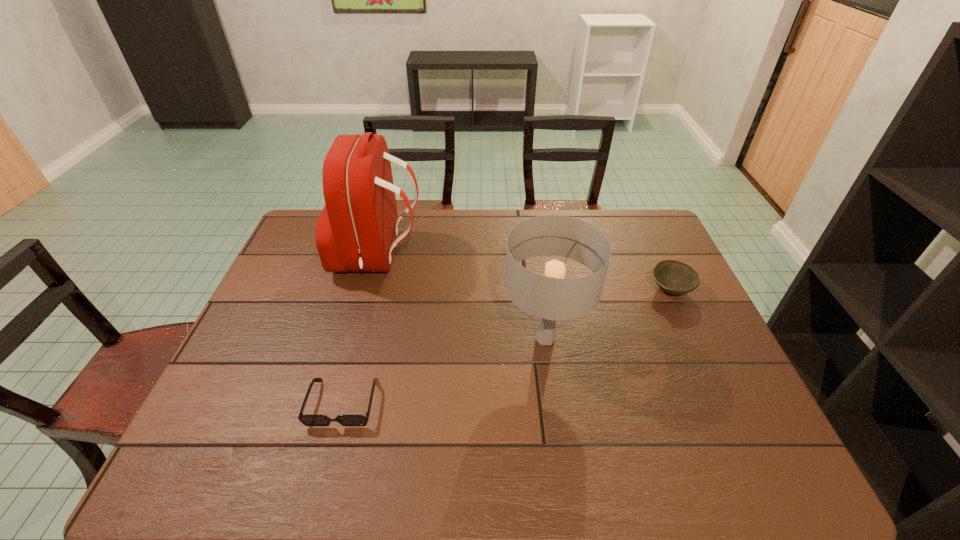
Where is `backpack`? The image size is (960, 540). backpack is located at coordinates (357, 231).

You are a GUI agent. You are given a task and a screenshot of the screen. Output one action in this format:
    pyautogui.click(x=<x>, y=<y>)
    Task: Click on the second object from right to left
    This screenshot has width=960, height=540.
    Given the screenshot: What is the action you would take?
    pyautogui.click(x=551, y=297)

Locate an element on the screen. lampshade is located at coordinates (551, 297).

Where is `the third tallest object`? the third tallest object is located at coordinates point(674,277).

Locate an element on the screen. bowl is located at coordinates pos(674,277).

Find the location of a particular element. The image size is (960, 540). the shortest object is located at coordinates (308, 420).

This screenshot has height=540, width=960. In order to click on sunglasses in this screenshot , I will do `click(308, 420)`.

The height and width of the screenshot is (540, 960). Identify the location of vacant area located on the strap side of the backpack. (514, 256).

The image size is (960, 540). Find the location of `vacant position located 0.210m on the front-facing side of the third object from left to right`. vacant position located 0.210m on the front-facing side of the third object from left to right is located at coordinates pyautogui.click(x=426, y=338).

At what (x,y) coordinates should I click in order to perform the action: click on vacant space located 0.260m on the front-facing side of the third object from left to right. Please return your answer as a coordinate pair (x, y). The image size is (960, 540). Looking at the image, I should click on (408, 338).